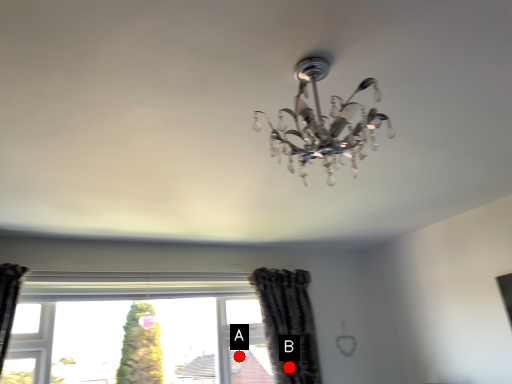
Question: Two points are circled on the image, labeled by A and B beside each circle. Which point appears closest to the camera in this image?

Choices:
 (A) A is closer
 (B) B is closer

Answer: (B)